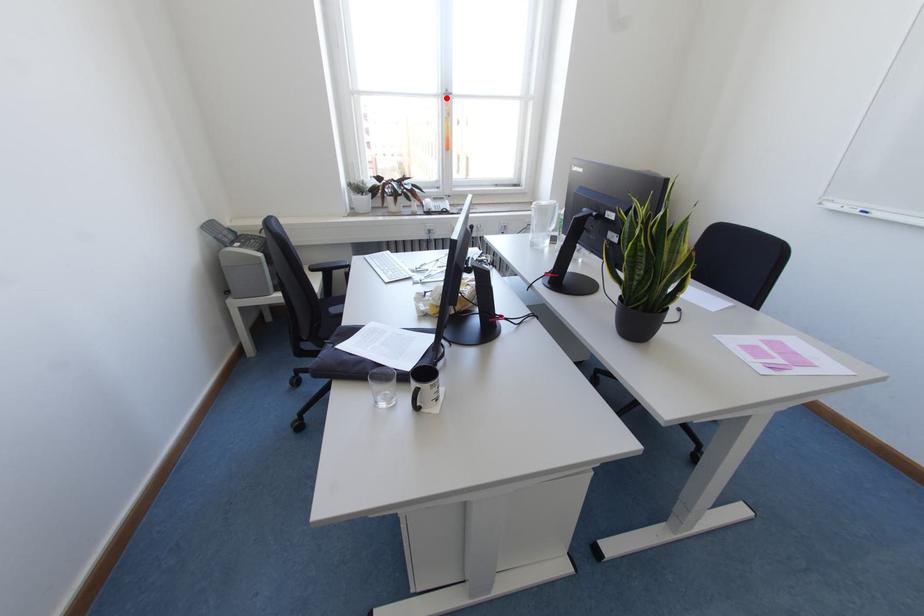
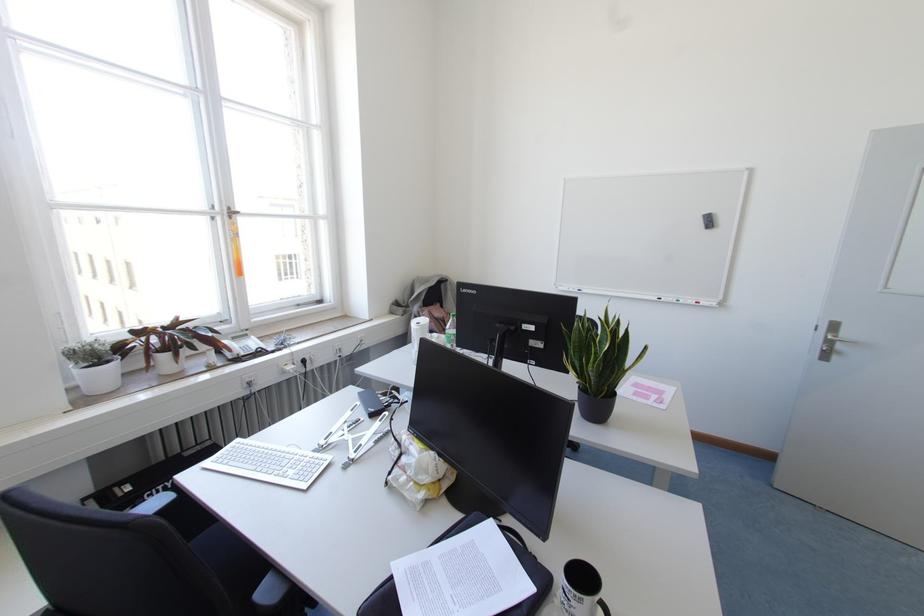
The point at the highlighted location is marked in the first image. Where is the corresponding point in the second image?

(229, 217)